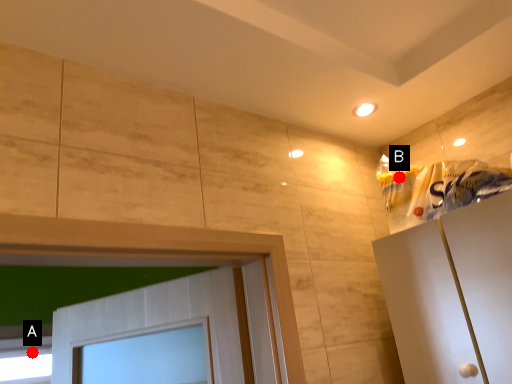
Question: Two points are circled on the image, labeled by A and B beside each circle. Which point is farther to the camera?

Choices:
 (A) A is further
 (B) B is further

Answer: (A)